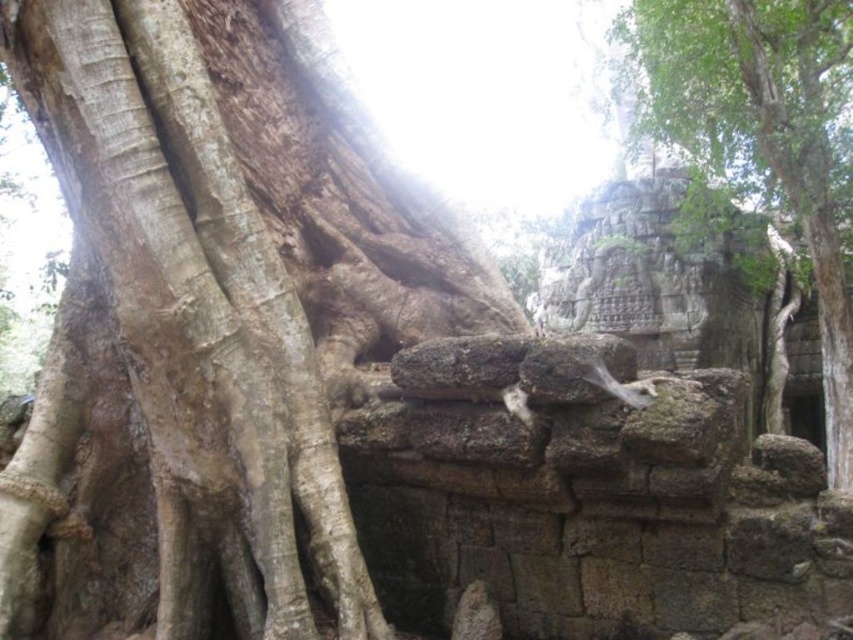
You are a hiker who wants to touch the smooth brown bark at center. If your arm can reach up to 1.8 meters, can you reach it?

The smooth brown bark at center and viewer are 2.05 meters apart from each other. Since your arm can only reach up to 1.8 meters, you cannot reach the smooth brown bark at center.

Based on the photo, you are an architect examining the ancient structure. You notice the smooth brown bark at center and the green rough stone wall at upper right. Which object is located to the left of the other?

The smooth brown bark at center is positioned on the left side of the green rough stone wall at upper right.

You are standing in front of an ancient temple structure with a large tree. You notice two points marked in the scene. The first point is at coordinate point [129,0] and the second is at point [683,76]. Which point is closer to your current position?

Point [129,0] is closer to the camera than point [683,76], so the first point is closer to your current position.